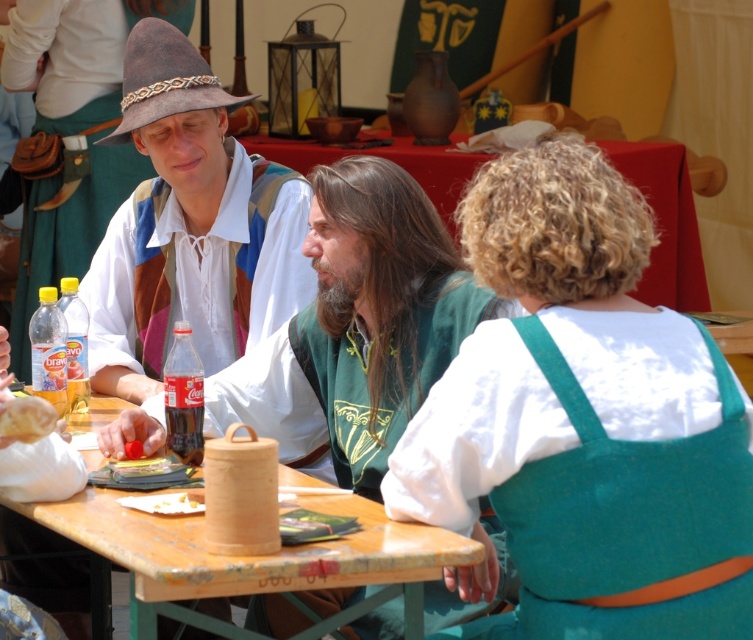
Question: Is white cotton shirt at center thinner than wooden table at center?

Choices:
 (A) yes
 (B) no

Answer: (A)

Question: Does green felt vest at center appear over yellow soft bread at table center?

Choices:
 (A) yes
 (B) no

Answer: (A)

Question: Which is farther from the yellow soft bread at table center?

Choices:
 (A) white paper napkin at table center
 (B) wooden at center
 (C) white cotton apron at center

Answer: (C)

Question: Can you confirm if white cotton apron at center is wider than wooden table at center?

Choices:
 (A) no
 (B) yes

Answer: (A)

Question: Estimate the real-world distances between objects in this image. Which object is farther from the white cotton shirt at center?

Choices:
 (A) yellow soft bread at table center
 (B) wooden at center

Answer: (A)

Question: Which of these objects is positioned farthest from the green felt vest at center?

Choices:
 (A) white paper napkin at table center
 (B) matte brown hat at upper left
 (C) wooden at center
 (D) white cotton apron at center

Answer: (D)